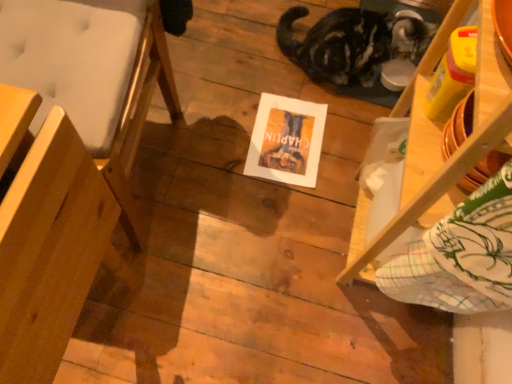
This screenshot has height=384, width=512. Find the location of `wooden table at right`. wooden table at right is located at coordinates (426, 160).

In order to face wooden table at right, should I rotate leftwards or rightwards?

A 21.215 degree turn to the right will do.

Describe the element at coordinates (426, 160) in the screenshot. I see `wooden table at right` at that location.

Locate an element on the screen. The height and width of the screenshot is (384, 512). wooden table at right is located at coordinates (426, 160).